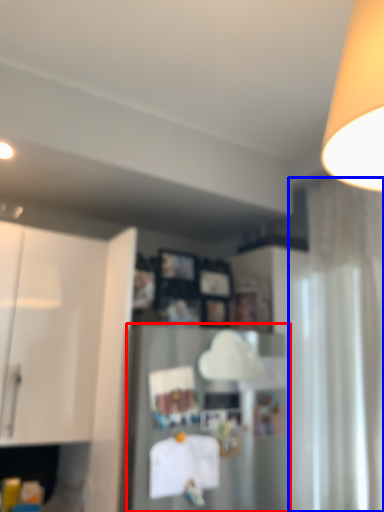
Question: Which object is closer to the camera taking this photo, appliance (highlighted by a red box) or curtain (highlighted by a blue box)?

Choices:
 (A) appliance
 (B) curtain

Answer: (A)